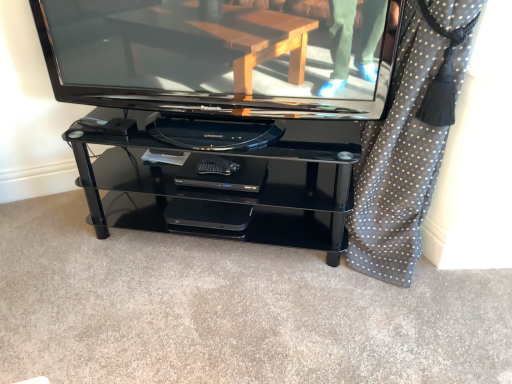
Question: From the image's perspective, is polka dot fabric at right beneath black plastic dvd player at center?

Choices:
 (A) no
 (B) yes

Answer: (A)

Question: Considering the relative sizes of polka dot fabric at right and black plastic dvd player at center in the image provided, is polka dot fabric at right shorter than black plastic dvd player at center?

Choices:
 (A) no
 (B) yes

Answer: (A)

Question: From the image's perspective, is polka dot fabric at right above black plastic dvd player at center?

Choices:
 (A) no
 (B) yes

Answer: (B)

Question: Considering the relative positions of polka dot fabric at right and black plastic dvd player at center in the image provided, is polka dot fabric at right to the left of black plastic dvd player at center from the viewer's perspective?

Choices:
 (A) no
 (B) yes

Answer: (A)

Question: Can you confirm if polka dot fabric at right is wider than black plastic dvd player at center?

Choices:
 (A) no
 (B) yes

Answer: (B)

Question: Does polka dot fabric at right have a lesser width compared to black plastic dvd player at center?

Choices:
 (A) no
 (B) yes

Answer: (A)

Question: Can you confirm if glossy black television at center is smaller than black plastic dvd player at center?

Choices:
 (A) no
 (B) yes

Answer: (A)

Question: Is glossy black television at center to the right of black plastic dvd player at center from the viewer's perspective?

Choices:
 (A) no
 (B) yes

Answer: (A)

Question: Is glossy black television at center closer to the viewer compared to black plastic dvd player at center?

Choices:
 (A) yes
 (B) no

Answer: (A)

Question: Does glossy black television at center have a greater height compared to black plastic dvd player at center?

Choices:
 (A) no
 (B) yes

Answer: (B)

Question: Does glossy black television at center turn towards black plastic dvd player at center?

Choices:
 (A) yes
 (B) no

Answer: (B)

Question: Is glossy black television at center surrounding black plastic dvd player at center?

Choices:
 (A) no
 (B) yes

Answer: (A)

Question: Can you confirm if polka dot fabric at right is smaller than glossy black television at center?

Choices:
 (A) yes
 (B) no

Answer: (B)